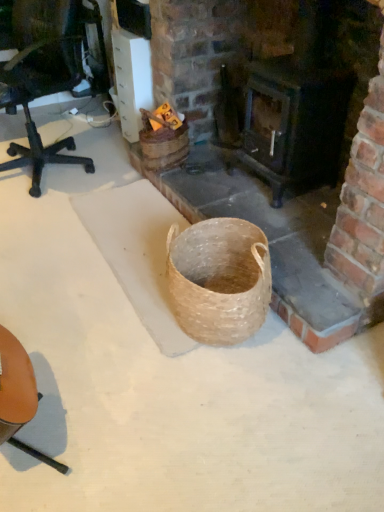
The image size is (384, 512). Describe the element at coordinates (18, 395) in the screenshot. I see `brown leather chair at lower left` at that location.

Measure the distance between point [49,464] and camera.

Point [49,464] and camera are 4.03 feet apart from each other.

What do you see at coordinates (327, 241) in the screenshot? The image size is (384, 512). I see `brick fireplace at center` at bounding box center [327, 241].

Measure the distance between point (305, 295) and camera.

Point (305, 295) is 5.02 feet from camera.

The width and height of the screenshot is (384, 512). What are the coordinates of `dark wood stove at center` in the screenshot? It's located at pyautogui.click(x=294, y=123).

How different are the orientations of dark wood stove at center and brick fireplace at center in degrees?

The angular difference between dark wood stove at center and brick fireplace at center is 0.848 degrees.

Which object is positioned more to the left, dark wood stove at center or brick fireplace at center?

Positioned to the left is brick fireplace at center.

Which of these two, dark wood stove at center or brick fireplace at center, is thinner?

Thinner between the two is dark wood stove at center.

Between dark wood stove at center and brown leather chair at lower left, which one has smaller size?

brown leather chair at lower left.

Which is in front, point (260, 93) or point (8, 418)?

Point (8, 418)

The width and height of the screenshot is (384, 512). Find the location of `chair on the left of dark wood stove at center`. chair on the left of dark wood stove at center is located at coordinates (18, 395).

Is brick fireplace at center in front of or behind brown leather chair at lower left in the image?

brick fireplace at center is behind brown leather chair at lower left.

Does brick fireplace at center turn towards brown leather chair at lower left?

No.

Is brick fireplace at center next to brown leather chair at lower left?

No, brick fireplace at center is not making contact with brown leather chair at lower left.

Identify the location of fireplace located below the dark wood stove at center (from the image's perspective). (327, 241).

Consider the image. Would you say brick fireplace at center is a long distance from dark wood stove at center?

No, brick fireplace at center is not far away from dark wood stove at center.

Is brick fireplace at center aimed at dark wood stove at center?

No, brick fireplace at center is not oriented towards dark wood stove at center.

From the image's perspective, relative to brick fireplace at center, is brown leather chair at lower left above or below?

Based on their image positions, brown leather chair at lower left is located beneath brick fireplace at center.

From the picture: Which of these two, brown leather chair at lower left or brick fireplace at center, is thinner?

brown leather chair at lower left.

Considering the positions of objects brown leather chair at lower left and brick fireplace at center in the image provided, who is more to the left, brown leather chair at lower left or brick fireplace at center?

brown leather chair at lower left.

Could you tell me if brown leather chair at lower left is facing brick fireplace at center?

No, brown leather chair at lower left is not oriented towards brick fireplace at center.

Which is closer, (25, 361) or (328, 100)?

Point (25, 361) is closer to the camera than point (328, 100).

Could you tell me if brown leather chair at lower left is turned towards dark wood stove at center?

No, brown leather chair at lower left does not turn towards dark wood stove at center.

Locate an element on the screen. This screenshot has width=384, height=512. stove above the brown leather chair at lower left (from a real-world perspective) is located at coordinates (294, 123).

From their relative heights in the image, would you say brown leather chair at lower left is taller or shorter than dark wood stove at center?

Clearly, brown leather chair at lower left is shorter compared to dark wood stove at center.

Image resolution: width=384 pixels, height=512 pixels. I want to click on stove behind the brick fireplace at center, so click(294, 123).

You are a GUI agent. You are given a task and a screenshot of the screen. Output one action in this format:
    pyautogui.click(x=<x>, y=<y>)
    Task: Click on the stove above the brown leather chair at lower left (from a real-world perspective)
    This screenshot has height=512, width=384.
    Given the screenshot: What is the action you would take?
    pyautogui.click(x=294, y=123)

Considering their positions, is dark wood stove at center positioned closer to brown leather chair at lower left than brick fireplace at center?

brick fireplace at center is positioned closer to the anchor brown leather chair at lower left.

Which object lies further to the anchor point dark wood stove at center, brick fireplace at center or brown leather chair at lower left?

Based on the image, brown leather chair at lower left appears to be further to dark wood stove at center.

Based on their spatial positions, is brick fireplace at center or dark wood stove at center further from brown leather chair at lower left?

dark wood stove at center lies further to brown leather chair at lower left than the other object.

Based on their spatial positions, is dark wood stove at center or brown leather chair at lower left closer to brick fireplace at center?

dark wood stove at center is closer to brick fireplace at center.

When comparing their distances from dark wood stove at center, does brown leather chair at lower left or brick fireplace at center seem closer?

brick fireplace at center.

When comparing their distances from brick fireplace at center, does brown leather chair at lower left or dark wood stove at center seem closer?

dark wood stove at center lies closer to brick fireplace at center than the other object.

The height and width of the screenshot is (512, 384). I want to click on fireplace between brown leather chair at lower left and dark wood stove at center, so click(327, 241).